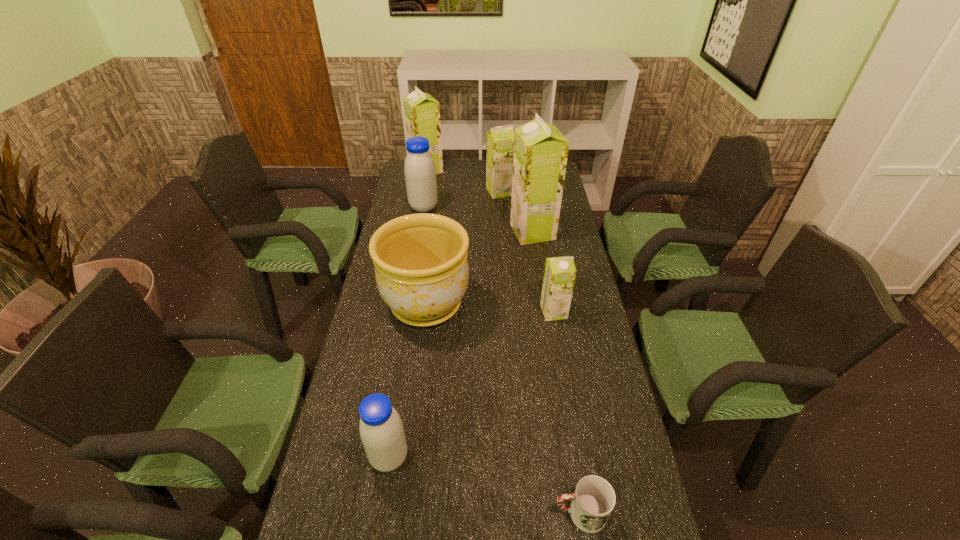
I want to click on free space that satisfies the following two spatial constraints: 1. on the back side of the third farthest soya milk; 2. on the right side of the second farthest soya milk, so (x=426, y=192).